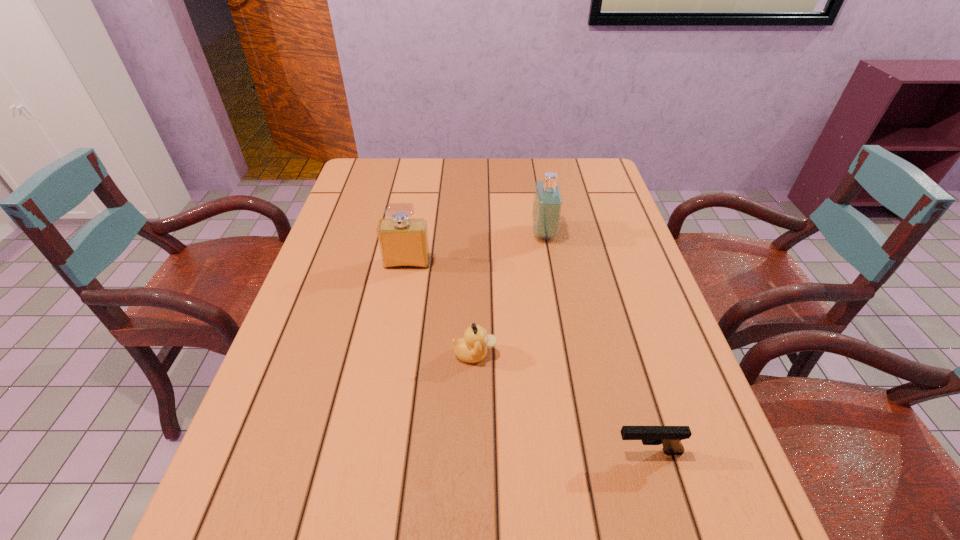
Where is `the farther perfume`? The image size is (960, 540). the farther perfume is located at coordinates (547, 204).

The height and width of the screenshot is (540, 960). I want to click on the second object from right to left, so click(547, 204).

This screenshot has width=960, height=540. I want to click on the left perfume, so click(403, 242).

At what (x,y) coordinates should I click in order to perform the action: click on the nearer perfume. Please return your answer as a coordinate pair (x, y). The image size is (960, 540). Looking at the image, I should click on (403, 242).

Where is `duckling`? This screenshot has width=960, height=540. duckling is located at coordinates (472, 348).

Identify the location of the second nearest object. (472, 348).

This screenshot has width=960, height=540. I want to click on pistol, so click(670, 437).

At what (x,y) coordinates should I click in order to perform the action: click on the nearest object. Please return your answer as a coordinate pair (x, y). Looking at the image, I should click on (670, 437).

Where is `vacant space situated on the front label of the right perfume`? The height and width of the screenshot is (540, 960). vacant space situated on the front label of the right perfume is located at coordinates (501, 233).

The image size is (960, 540). Identify the location of free space located 0.340m on the front label of the right perfume. (415, 233).